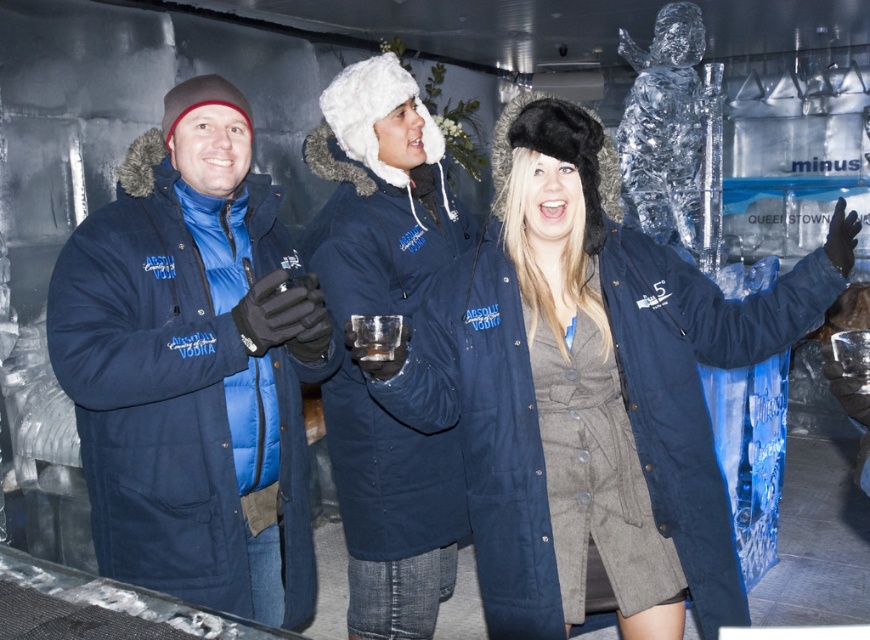
Question: Which point is farther to the camera?

Choices:
 (A) (241, 118)
 (B) (573, 131)

Answer: (A)

Question: Which point appears farthest from the camera in this image?

Choices:
 (A) (502, 371)
 (B) (164, 250)

Answer: (B)

Question: Is matte blue coat at left to the right of navy blue parka at center from the viewer's perspective?

Choices:
 (A) yes
 (B) no

Answer: (B)

Question: Does matte blue coat at left appear over navy blue parka at center?

Choices:
 (A) yes
 (B) no

Answer: (B)

Question: Is matte blue coat at left smaller than navy blue parka at center?

Choices:
 (A) yes
 (B) no

Answer: (A)

Question: Which of the following is the farthest from the observer?

Choices:
 (A) navy blue parka at center
 (B) matte blue coat at left

Answer: (B)